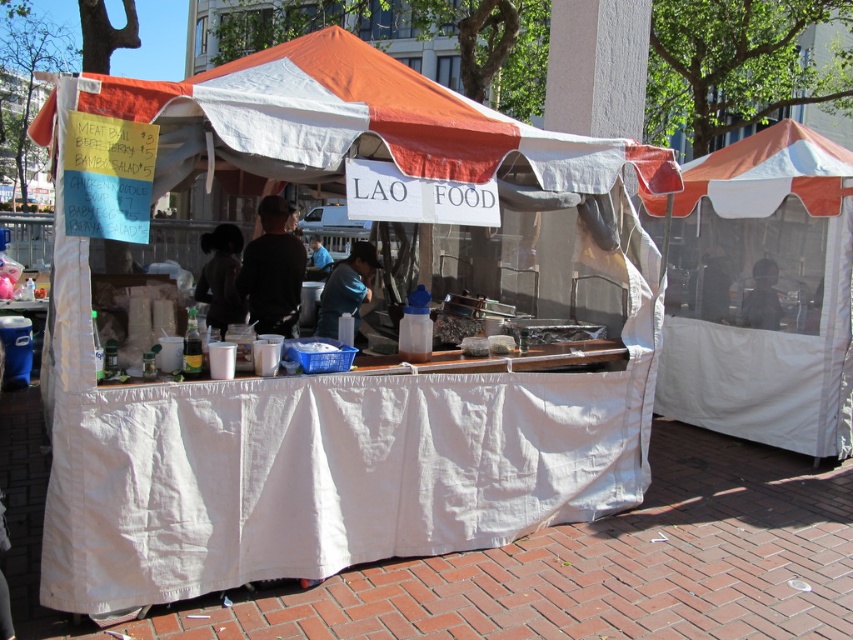
Question: Does orange fabric canopy at center have a greater width compared to dark matte face at upper right?

Choices:
 (A) yes
 (B) no

Answer: (A)

Question: Which point is farther from the camera taking this photo?

Choices:
 (A) (312, 264)
 (B) (157, 472)

Answer: (A)

Question: Which point is farther from the camera taking this photo?

Choices:
 (A) (264, 252)
 (B) (358, 298)
 (C) (842, 163)
 (D) (44, 568)

Answer: (C)

Question: Does white canvas tent at right lie in front of orange fabric canopy at center?

Choices:
 (A) no
 (B) yes

Answer: (A)

Question: Considering the relative positions of white canvas tent at center and white canvas tent at right in the image provided, where is white canvas tent at center located with respect to white canvas tent at right?

Choices:
 (A) right
 (B) left

Answer: (B)

Question: Considering the real-world distances, which object is closest to the blue shirt at center?

Choices:
 (A) white canvas tent at center
 (B) white canvas tent at right
 (C) black matte shirt at center

Answer: (C)